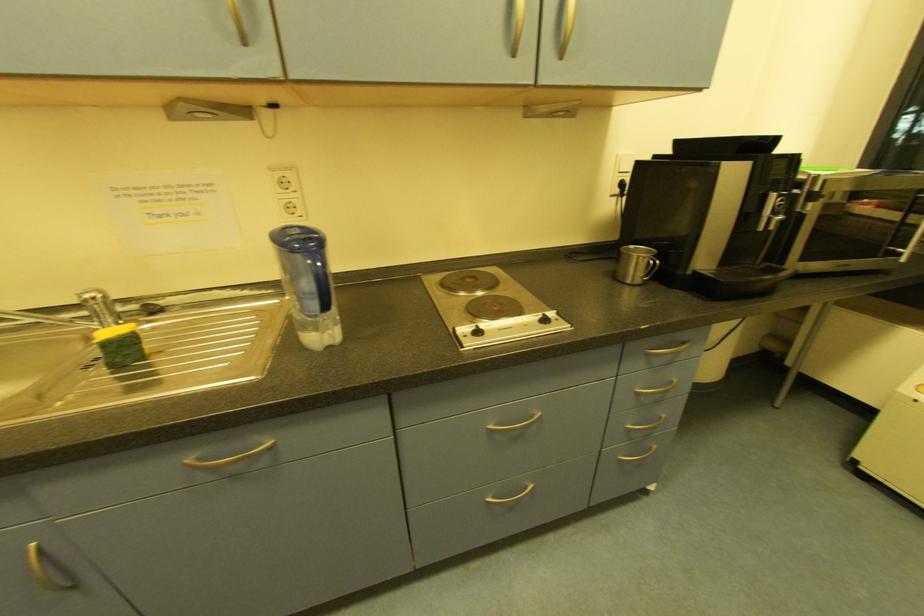
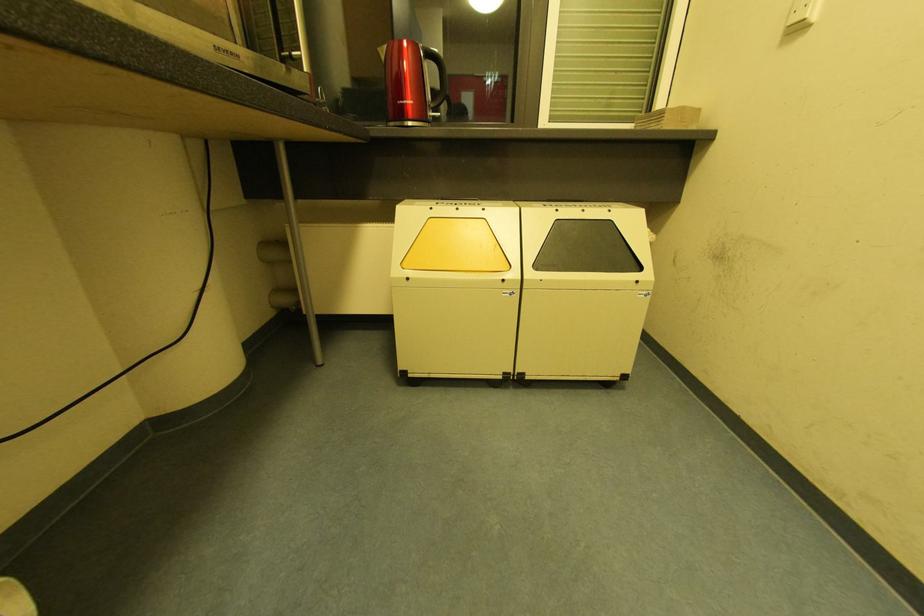
Question: The camera is either moving clockwise (left) or counter-clockwise (right) around the object. The first image is from the beginning of the video and the second image is from the end. Is the camera moving left or right when shooting the video?

Choices:
 (A) Left
 (B) Right

Answer: (A)